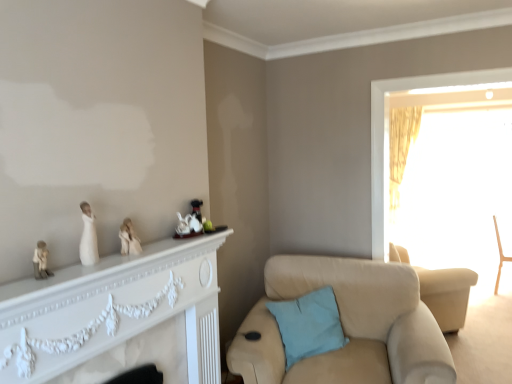
Where is `vacant space to the right of white porcelain figurine at left, placed as the first person when sorted from front to back`? The height and width of the screenshot is (384, 512). vacant space to the right of white porcelain figurine at left, placed as the first person when sorted from front to back is located at coordinates (117, 263).